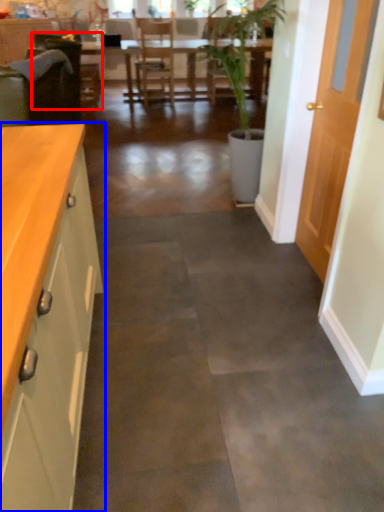
Question: Which point is further to the camera, armchair (highlighted by a red box) or cabinetry (highlighted by a blue box)?

Choices:
 (A) armchair
 (B) cabinetry

Answer: (A)